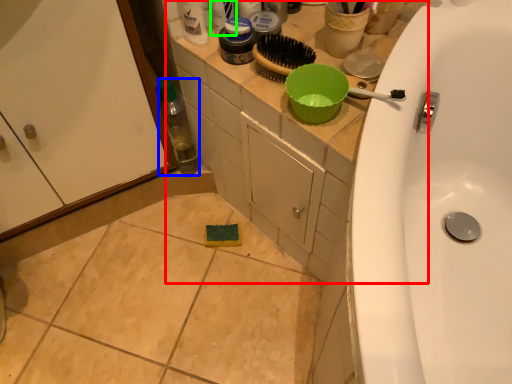
Question: Considering the real-world distances, which object is closest to counter top (highlighted by a red box)? bottle (highlighted by a blue box) or toiletry (highlighted by a green box).

Choices:
 (A) bottle
 (B) toiletry

Answer: (A)